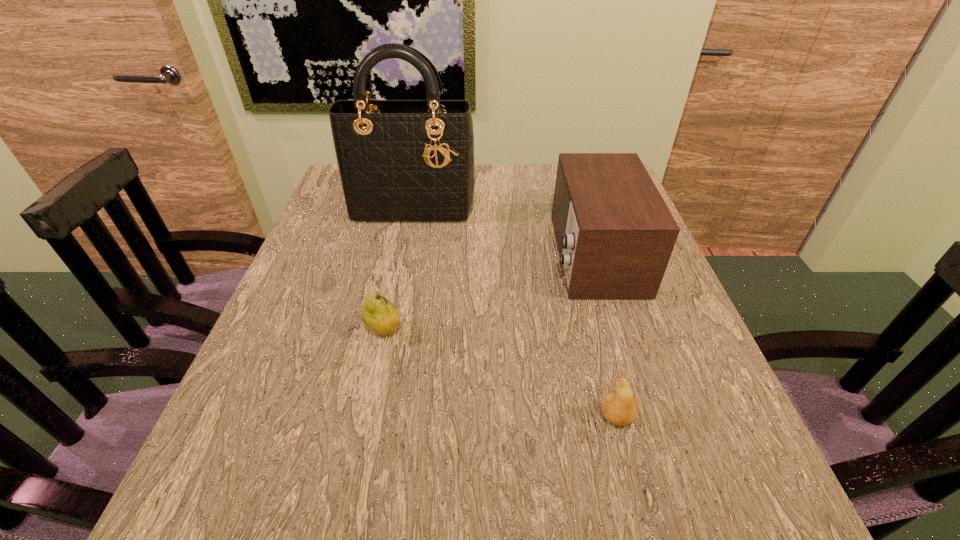
Select which object appears as the third closest to the tallest object. Please provide its 2D coordinates. Your answer should be formatted as a tuple, i.e. [(x, y)], where the tuple contains the x and y coordinates of a point satisfying the conditions above.

[(619, 407)]

You are a GUI agent. You are given a task and a screenshot of the screen. Output one action in this format:
    pyautogui.click(x=<x>, y=<y>)
    Task: Click on the blank area in the image that satisfies the following two spatial constraints: 1. at the front of the right pear with visible charms; 2. on the left side of the tallest object
    
    Given the screenshot: What is the action you would take?
    pos(370,417)

Where is `vacant position in the image that satisfies the following two spatial constraints: 1. at the front of the right pear with visible charms; 2. on the right side of the handbag`? vacant position in the image that satisfies the following two spatial constraints: 1. at the front of the right pear with visible charms; 2. on the right side of the handbag is located at coordinates (370, 417).

In order to click on vacant space that satisfies the following two spatial constraints: 1. on the front side of the right pear; 2. on the right side of the third farthest object in this screenshot , I will do (x=366, y=417).

Locate an element on the screen. The image size is (960, 540). vacant area that satisfies the following two spatial constraints: 1. at the front of the handbag with visible charms; 2. on the left side of the right pear is located at coordinates (370, 417).

I want to click on free location that satisfies the following two spatial constraints: 1. at the front of the nearest object with visible charms; 2. on the right side of the handbag, so click(x=370, y=417).